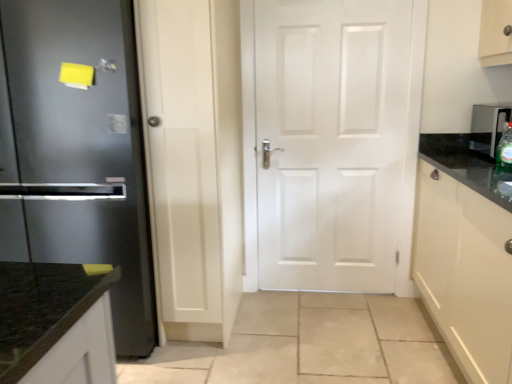
The width and height of the screenshot is (512, 384). What do you see at coordinates (505, 150) in the screenshot?
I see `green glass bottle at right` at bounding box center [505, 150].

Describe the element at coordinates (79, 151) in the screenshot. I see `satin steel refrigerator at left` at that location.

This screenshot has width=512, height=384. What do you see at coordinates (488, 127) in the screenshot? I see `metallic silver water dispenser at right` at bounding box center [488, 127].

What is the approximate height of glossy white cabinet at right?

It is 38.92 inches.

In order to click on green glass bottle at right in this screenshot , I will do `click(505, 150)`.

From the image's perspective, does green glass bottle at right appear lower than white matte door at center?

Yes, from the image's perspective, green glass bottle at right is below white matte door at center.

Locate an element on the screen. door that is on the left side of green glass bottle at right is located at coordinates (337, 142).

From the picture: Could you tell me if green glass bottle at right is facing white matte door at center?

No, green glass bottle at right does not turn towards white matte door at center.

Based on the photo, is the depth of metallic silver water dispenser at right greater than that of satin steel refrigerator at left?

Yes, metallic silver water dispenser at right is behind satin steel refrigerator at left.

Can you confirm if metallic silver water dispenser at right is taller than satin steel refrigerator at left?

No.

From a real-world perspective, is metallic silver water dispenser at right over satin steel refrigerator at left?

Yes, from a real-world perspective, metallic silver water dispenser at right is over satin steel refrigerator at left

Is satin steel refrigerator at left inside metallic silver water dispenser at right?

No, satin steel refrigerator at left is not inside metallic silver water dispenser at right.

Is point (470, 377) positioned behind point (505, 146)?

No, it is in front of (505, 146).

Is the position of glossy white cabinet at right more distant than that of green glass bottle at right?

No, the depth of glossy white cabinet at right is less than that of green glass bottle at right.

Does glossy white cabinet at right appear on the left side of green glass bottle at right?

Incorrect, glossy white cabinet at right is not on the left side of green glass bottle at right.

From the image's perspective, who appears lower, glossy white cabinet at right or green glass bottle at right?

glossy white cabinet at right, from the image's perspective.

Which of these two, white matte door at center or glossy white cabinet at right, is wider?

glossy white cabinet at right.

Is white matte door at center to the right of glossy white cabinet at right from the viewer's perspective?

No.

Is white matte door at center located outside glossy white cabinet at right?

white matte door at center is positioned outside glossy white cabinet at right.

Between white matte door at center and glossy white cabinet at right, which one has more height?

Standing taller between the two is white matte door at center.

Could you tell me if white matte door at center is facing satin steel refrigerator at left?

No, white matte door at center is not aimed at satin steel refrigerator at left.

Is white matte door at center not close to satin steel refrigerator at left?

Indeed, white matte door at center is not near satin steel refrigerator at left.

Which is nearer, (378, 15) or (96, 5)?

Point (96, 5)

Is green glass bottle at right at the right side of satin steel refrigerator at left?

Indeed, green glass bottle at right is positioned on the right side of satin steel refrigerator at left.

Can you see green glass bottle at right touching satin steel refrigerator at left?

There is a gap between green glass bottle at right and satin steel refrigerator at left.

Is green glass bottle at right further to camera compared to satin steel refrigerator at left?

That is True.

Locate an element on the screen. Image resolution: width=512 pixels, height=384 pixels. bottle on the right of the satin steel refrigerator at left is located at coordinates (505, 150).

From the image's perspective, between white matte door at center and green glass bottle at right, which one is located above?

white matte door at center is shown above in the image.

Between white matte door at center and green glass bottle at right, which one has less height?

Standing shorter between the two is green glass bottle at right.

Which of these two, white matte door at center or green glass bottle at right, is bigger?

white matte door at center.

Is white matte door at center in front of or behind green glass bottle at right in the image?

white matte door at center is behind green glass bottle at right.

Locate an element on the screen. This screenshot has height=384, width=512. door on the left of green glass bottle at right is located at coordinates (337, 142).

What are the coordinates of `refrigerator located below the metallic silver water dispenser at right (from the image's perspective)` in the screenshot? It's located at (79, 151).

Which object lies nearer to the anchor point metallic silver water dispenser at right, satin steel refrigerator at left or white matte door at center?

white matte door at center.

Looking at the image, which one is located closer to glossy white cabinet at right, white matte door at center or green glass bottle at right?

The object closer to glossy white cabinet at right is green glass bottle at right.

Estimate the real-world distances between objects in this image. Which object is closer to glossy white cabinet at right, satin steel refrigerator at left or metallic silver water dispenser at right?

Among the two, metallic silver water dispenser at right is located nearer to glossy white cabinet at right.

Based on their spatial positions, is metallic silver water dispenser at right or green glass bottle at right further from glossy white cabinet at right?

Among the two, metallic silver water dispenser at right is located further to glossy white cabinet at right.

Looking at the image, which one is located further to green glass bottle at right, satin steel refrigerator at left or white matte door at center?

satin steel refrigerator at left is further to green glass bottle at right.

Based on their spatial positions, is satin steel refrigerator at left or green glass bottle at right further from metallic silver water dispenser at right?

Based on the image, satin steel refrigerator at left appears to be further to metallic silver water dispenser at right.

Which object lies nearer to the anchor point glossy white cabinet at right, green glass bottle at right or white matte door at center?

green glass bottle at right is positioned closer to the anchor glossy white cabinet at right.

In the scene shown: Based on their spatial positions, is glossy white cabinet at right or green glass bottle at right closer to satin steel refrigerator at left?

Among the two, glossy white cabinet at right is located nearer to satin steel refrigerator at left.

You are a GUI agent. You are given a task and a screenshot of the screen. Output one action in this format:
    pyautogui.click(x=<x>, y=<y>)
    Task: Click on the door situated between satin steel refrigerator at left and glossy white cabinet at right from left to right
    The width and height of the screenshot is (512, 384).
    Given the screenshot: What is the action you would take?
    pyautogui.click(x=337, y=142)

Locate an element on the screen. This screenshot has width=512, height=384. bottle between satin steel refrigerator at left and metallic silver water dispenser at right from left to right is located at coordinates (505, 150).

This screenshot has height=384, width=512. I want to click on door between satin steel refrigerator at left and green glass bottle at right in the horizontal direction, so click(x=337, y=142).

The height and width of the screenshot is (384, 512). Identify the location of bottle between glossy white cabinet at right and metallic silver water dispenser at right in the front-back direction. (505, 150).